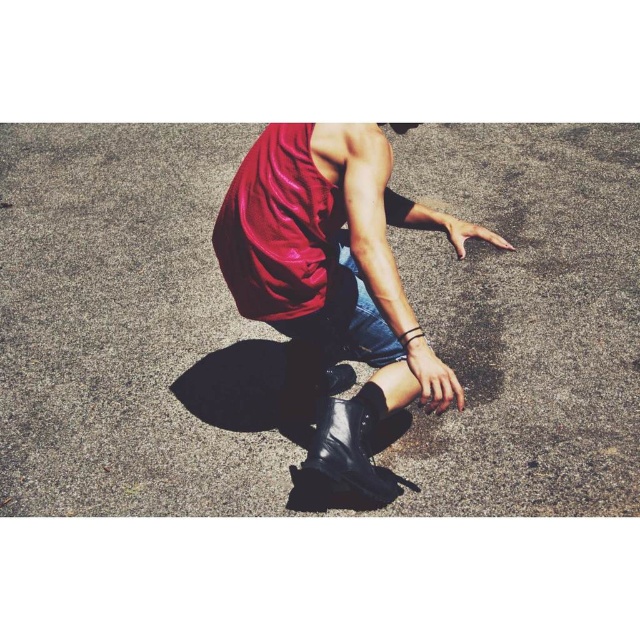
Question: Is shiny red tank top at center in front of black leather boot at lower center?

Choices:
 (A) yes
 (B) no

Answer: (A)

Question: Does shiny red tank top at center have a smaller size compared to black leather boot at lower center?

Choices:
 (A) no
 (B) yes

Answer: (A)

Question: Which of the following is the closest to the observer?

Choices:
 (A) (340, 472)
 (B) (282, 232)

Answer: (B)

Question: Is the position of shiny red tank top at center more distant than that of black leather boot at lower center?

Choices:
 (A) yes
 (B) no

Answer: (B)

Question: Which of the following is the closest to the observer?

Choices:
 (A) (236, 300)
 (B) (314, 456)

Answer: (B)